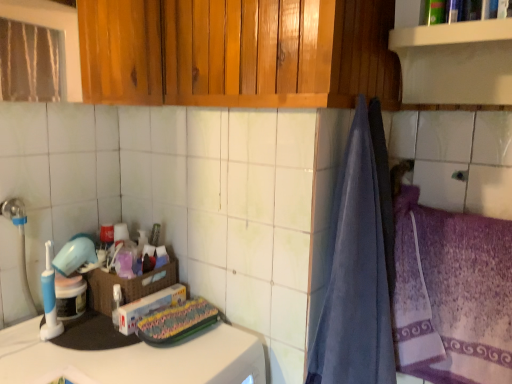
You are a GUI agent. You are given a task and a screenshot of the screen. Output one action in this format:
    pyautogui.click(x=<x>, y=<y>)
    Task: Click on the white matte counter top at lower left
    Image resolution: width=512 pixels, height=384 pixels.
    Given the screenshot: What is the action you would take?
    pyautogui.click(x=133, y=359)

What do you see at coordinates (234, 53) in the screenshot?
I see `shiny wood cabinets at upper center` at bounding box center [234, 53].

What is the approximate width of purple textured towel at right?

purple textured towel at right is 12.45 inches wide.

In order to face woven brown basket at center, should I rotate leftwards or rightwards?

Turn left approximately 16.207 degrees to face it.

What do you see at coordinates (453, 61) in the screenshot?
I see `white matte shelf at upper right` at bounding box center [453, 61].

Where is `white matte counter top at lower left`? white matte counter top at lower left is located at coordinates (133, 359).

Find the location of a particular element. This screenshot has height=384, width=512. curtain on the right of the translucent plastic container at center is located at coordinates (359, 264).

How different are the orientations of blue soft towel at right and translucent plastic container at center in degrees?

3.69 degrees separate the facing orientations of blue soft towel at right and translucent plastic container at center.

From the image's perspective, is blue soft towel at right over translucent plastic container at center?

Yes, from the image's perspective, blue soft towel at right is above translucent plastic container at center.

Is point (323, 315) more distant than point (161, 265)?

No, it is not.

Based on the photo, which object is closer to the camera taking this photo, woven brown basket at center or shiny wood cabinets at upper center?

shiny wood cabinets at upper center is closer to the camera.

Is the surface of woven brown basket at center in direct contact with shiny wood cabinets at upper center?

woven brown basket at center is not next to shiny wood cabinets at upper center, and they're not touching.

From a real-world perspective, is woven brown basket at center located higher than shiny wood cabinets at upper center?

No.

Could you tell me if shiny wood cabinets at upper center is turned towards purple textured towel at right?

No, shiny wood cabinets at upper center is not aimed at purple textured towel at right.

From a real-world perspective, is shiny wood cabinets at upper center under purple textured towel at right?

No, from a real-world perspective, shiny wood cabinets at upper center is not below purple textured towel at right.

Is shiny wood cabinets at upper center touching purple textured towel at right?

They are not placed beside each other.

What's the angular difference between blue soft towel at right and woven brown basket at center's facing directions?

The angular difference between blue soft towel at right and woven brown basket at center is 0.928 degrees.

You are a GUI agent. You are given a task and a screenshot of the screen. Output one action in this format:
    pyautogui.click(x=<x>, y=<y>)
    Task: Click on the basket below the blue soft towel at right (from the image's perspective)
    The height and width of the screenshot is (384, 512).
    Given the screenshot: What is the action you would take?
    pyautogui.click(x=128, y=285)

Considering the relative sizes of blue soft towel at right and woven brown basket at center in the image provided, is blue soft towel at right shorter than woven brown basket at center?

Incorrect, the height of blue soft towel at right does not fall short of that of woven brown basket at center.

From the image's perspective, is blue soft towel at right above or below woven brown basket at center?

From the image's perspective, blue soft towel at right appears above woven brown basket at center.

From a real-world perspective, does shiny wood cabinets at upper center sit lower than woven brown basket at center?

Actually, shiny wood cabinets at upper center is physically above woven brown basket at center in the real world.

Between shiny wood cabinets at upper center and woven brown basket at center, which one is positioned behind?

woven brown basket at center is more distant.

Is shiny wood cabinets at upper center not inside woven brown basket at center?

Yes, shiny wood cabinets at upper center is not within woven brown basket at center.

Which object is thinner, shiny wood cabinets at upper center or woven brown basket at center?

shiny wood cabinets at upper center is thinner.

In the scene shown: From the image's perspective, would you say blue soft towel at right is positioned over white matte shelf at upper right?

No.

Are blue soft towel at right and white matte shelf at upper right making contact?

No, blue soft towel at right is not in contact with white matte shelf at upper right.

Is blue soft towel at right bigger or smaller than white matte shelf at upper right?

A: In the image, blue soft towel at right appears to be smaller than white matte shelf at upper right.

This screenshot has width=512, height=384. In order to click on curtain below the white matte shelf at upper right (from the image's perspective) in this screenshot , I will do `click(359, 264)`.

Which object is closer to the camera taking this photo, woven brown basket at center or purple textured towel at right?

Positioned in front is purple textured towel at right.

Identify the location of beach towel to the right of woven brown basket at center. (452, 294).

Does woven brown basket at center have a smaller size compared to purple textured towel at right?

Correct, woven brown basket at center occupies less space than purple textured towel at right.

Which is less distant, (x=137, y=284) or (x=481, y=359)?

Point (x=137, y=284) is positioned farther from the camera compared to point (x=481, y=359).

Where is `curtain above the translucent plastic container at center (from the image's perspective)`? curtain above the translucent plastic container at center (from the image's perspective) is located at coordinates (359, 264).

You are a GUI agent. You are given a task and a screenshot of the screen. Output one action in this format:
    pyautogui.click(x=<x>, y=<y>)
    Task: Click on the basket below the shiny wood cabinets at upper center (from a real-world perspective)
    
    Given the screenshot: What is the action you would take?
    pyautogui.click(x=128, y=285)

Considering their positions, is translucent plastic container at center positioned closer to white matte counter top at lower left than shiny wood cabinets at upper center?

The object closer to white matte counter top at lower left is translucent plastic container at center.

From the image, which object appears to be farther from purple textured towel at right, woven brown basket at center or blue soft towel at right?

Based on the image, woven brown basket at center appears to be further to purple textured towel at right.

Looking at the image, which one is located further to white matte shelf at upper right, white matte counter top at lower left or translucent plastic container at center?

The object further to white matte shelf at upper right is translucent plastic container at center.

When comparing their distances from white matte counter top at lower left, does shiny wood cabinets at upper center or blue soft towel at right seem further?

Among the two, shiny wood cabinets at upper center is located further to white matte counter top at lower left.

Which object lies further to the anchor point blue soft towel at right, white matte counter top at lower left or translucent plastic container at center?

translucent plastic container at center is positioned further to the anchor blue soft towel at right.

Looking at the image, which one is located closer to woven brown basket at center, translucent plastic container at center or blue soft towel at right?

translucent plastic container at center is closer to woven brown basket at center.

Looking at the image, which one is located further to white matte counter top at lower left, purple textured towel at right or shiny wood cabinets at upper center?

Based on the image, shiny wood cabinets at upper center appears to be further to white matte counter top at lower left.

Consider the image. Based on their spatial positions, is shiny wood cabinets at upper center or blue soft towel at right closer to purple textured towel at right?

Based on the image, blue soft towel at right appears to be nearer to purple textured towel at right.

You are a GUI agent. You are given a task and a screenshot of the screen. Output one action in this format:
    pyautogui.click(x=<x>, y=<y>)
    Task: Click on the cabinetry between translucent plastic container at center and purple textured towel at right from left to right
    The image size is (512, 384).
    Given the screenshot: What is the action you would take?
    pyautogui.click(x=234, y=53)

This screenshot has width=512, height=384. I want to click on toiletry between woven brown basket at center and white matte shelf at upper right, so click(161, 256).

You are a GUI agent. You are given a task and a screenshot of the screen. Output one action in this format:
    pyautogui.click(x=<x>, y=<y>)
    Task: Click on the beach towel that lies between shiny wood cabinets at upper center and white matte counter top at lower left from top to bottom
    Image resolution: width=512 pixels, height=384 pixels.
    Given the screenshot: What is the action you would take?
    pyautogui.click(x=452, y=294)

The width and height of the screenshot is (512, 384). Identify the location of counter top located between woven brown basket at center and white matte shelf at upper right in the left-right direction. 133,359.